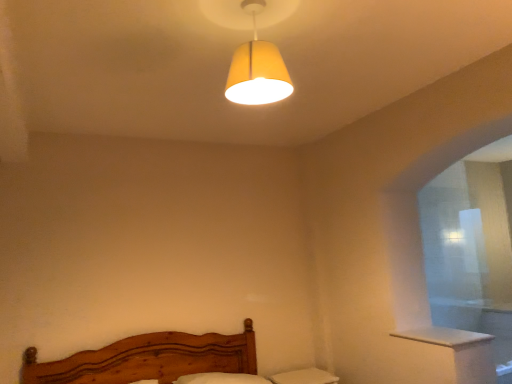
Question: Relative to white wood window sill at lower right, is matte yellow fabric lampshade at upper center in front or behind?

Choices:
 (A) behind
 (B) front

Answer: (B)

Question: From the image's perspective, is matte yellow fabric lampshade at upper center positioned above or below white wood window sill at lower right?

Choices:
 (A) below
 (B) above

Answer: (B)

Question: Is point (263, 77) positioned closer to the camera than point (415, 334)?

Choices:
 (A) farther
 (B) closer

Answer: (B)

Question: Does point (445, 329) appear closer or farther from the camera than point (284, 74)?

Choices:
 (A) farther
 (B) closer

Answer: (A)

Question: In terms of width, does white wood window sill at lower right look wider or thinner when compared to matte yellow fabric lampshade at upper center?

Choices:
 (A) wide
 (B) thin

Answer: (A)

Question: Is white wood window sill at lower right in front of or behind matte yellow fabric lampshade at upper center in the image?

Choices:
 (A) front
 (B) behind

Answer: (B)

Question: Is white wood window sill at lower right inside or outside of matte yellow fabric lampshade at upper center?

Choices:
 (A) outside
 (B) inside

Answer: (A)